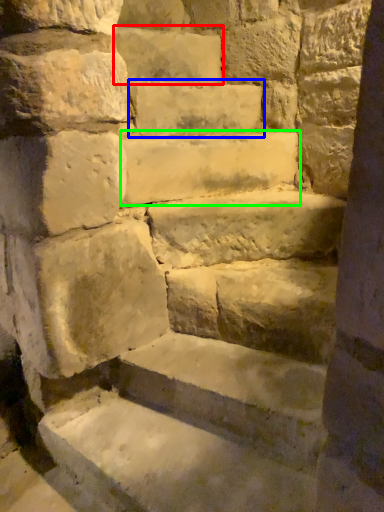
Question: Estimate the real-world distances between objects in this image. Which object is farther from brick (highlighted by a red box), brick (highlighted by a blue box) or stone (highlighted by a green box)?

Choices:
 (A) brick
 (B) stone

Answer: (B)